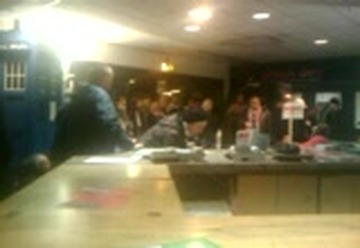
The width and height of the screenshot is (360, 248). Identify the location of table top motif. pyautogui.click(x=99, y=198), pyautogui.click(x=187, y=244).